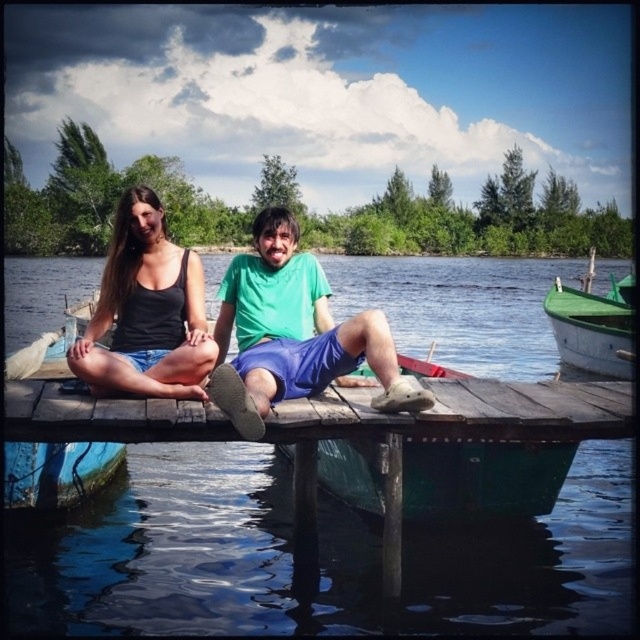
Is green matte shirt at center closer to camera compared to matte black tank top at center?

Yes, it is in front of matte black tank top at center.

Image resolution: width=640 pixels, height=640 pixels. What do you see at coordinates (292, 333) in the screenshot?
I see `green matte shirt at center` at bounding box center [292, 333].

You are a GUI agent. You are given a task and a screenshot of the screen. Output one action in this format:
    pyautogui.click(x=<x>, y=<y>)
    Task: Click on the green matte shirt at center
    Image resolution: width=640 pixels, height=640 pixels.
    Given the screenshot: What is the action you would take?
    pyautogui.click(x=292, y=333)

Is matte black tank top at center behind green wooden boat at right?

No, it is not.

Who is more distant from viewer, (97,384) or (593,310)?

Point (593,310)

Which is behind, point (129, 371) or point (557, 314)?

Point (557, 314)

At what (x,y) coordinates should I click in order to perform the action: click on matte black tank top at center. Please return your answer as a coordinate pair (x, y). Looking at the image, I should click on (147, 310).

How distant is transparent water at dock center from green wooden boat at right?

transparent water at dock center is 14.24 meters from green wooden boat at right.

Can you confirm if transparent water at dock center is shorter than green wooden boat at right?

No, transparent water at dock center is not shorter than green wooden boat at right.

Does point (349, 288) lie behind point (579, 320)?

Yes, point (349, 288) is behind point (579, 320).

Locate an element on the screen. The width and height of the screenshot is (640, 640). transparent water at dock center is located at coordinates (192, 554).